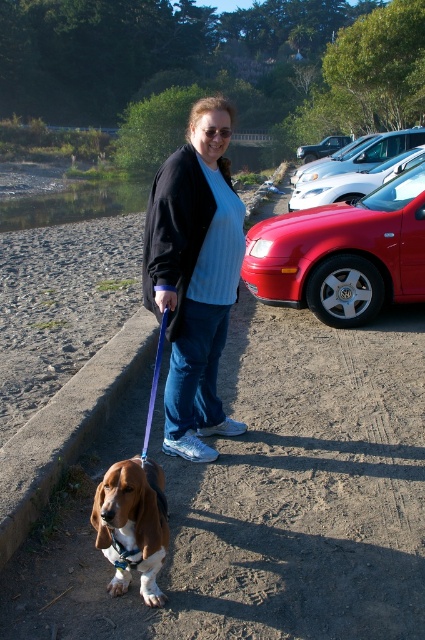
You are a GUI agent. You are given a task and a screenshot of the screen. Output one action in this format:
    pyautogui.click(x=<x>, y=<y>)
    Task: Click on the shiny red car at right
    
    Given the screenshot: What is the action you would take?
    pyautogui.click(x=343, y=253)

Which is in front, point (359, 209) or point (371, 179)?

Point (359, 209) is in front.

The width and height of the screenshot is (425, 640). I want to click on shiny red car at right, so click(x=343, y=253).

Which is more to the right, matte black jacket at center or shiny red car at right?

Positioned to the right is shiny red car at right.

Can you confirm if matte black jacket at center is taller than shiny red car at right?

Correct, matte black jacket at center is much taller as shiny red car at right.

In order to click on matte black jacket at center in this screenshot , I will do `click(195, 275)`.

Between point (150, 525) and point (413, 161), which one is positioned behind?

Point (413, 161)

Who is lower down, brown and white fur at lower left or satin silver sedan at right?

Positioned lower is brown and white fur at lower left.

What do you see at coordinates (133, 524) in the screenshot? I see `brown and white fur at lower left` at bounding box center [133, 524].

Image resolution: width=425 pixels, height=640 pixels. What are the coordinates of `brown and white fur at lower left` in the screenshot? It's located at (133, 524).